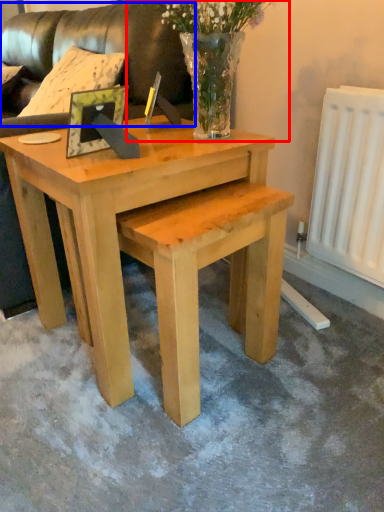
Question: Which object appears closest to the camera in this image, floral arrangement (highlighted by a red box) or couch (highlighted by a blue box)?

Choices:
 (A) floral arrangement
 (B) couch

Answer: (A)